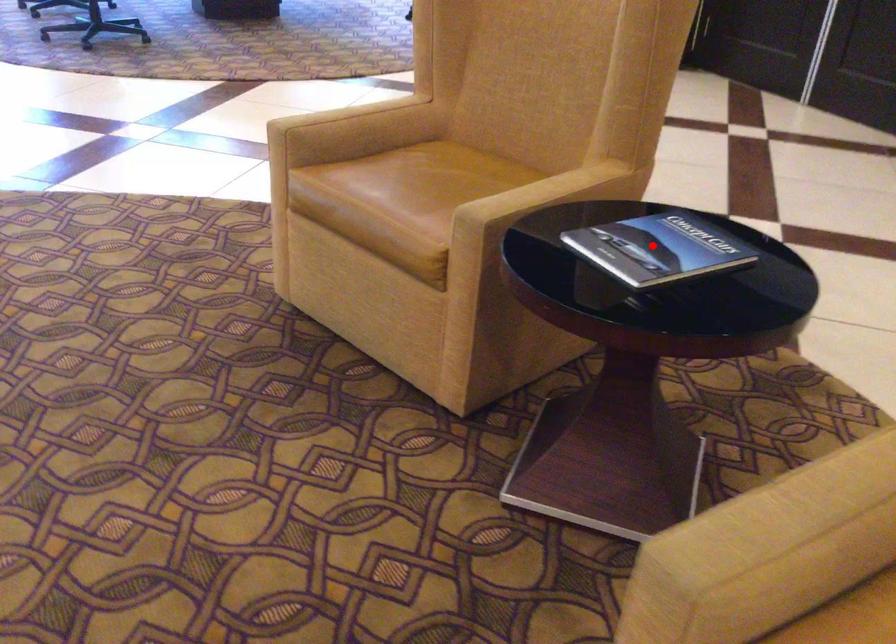
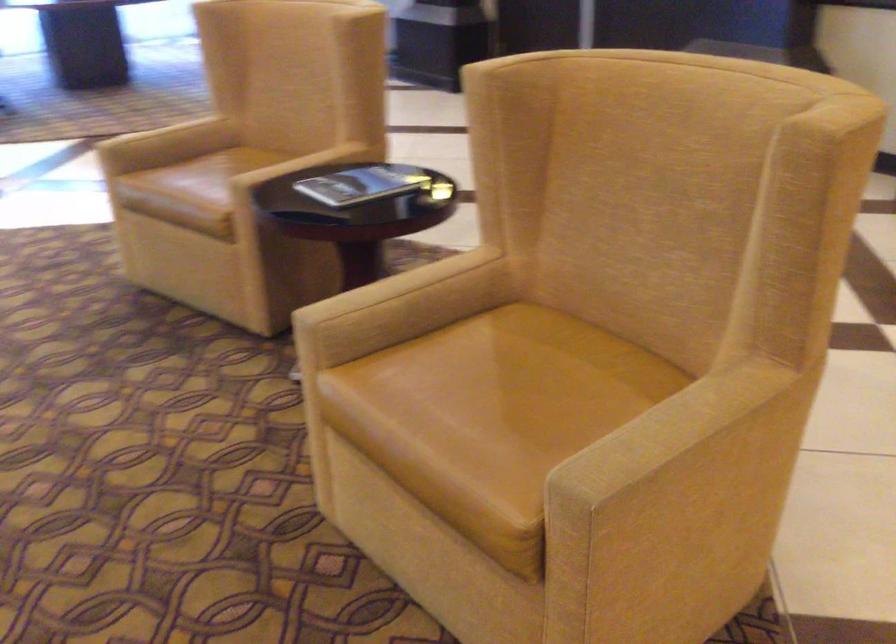
Where in the second image is the point corresponding to the highlighted location from the first image?

(363, 184)